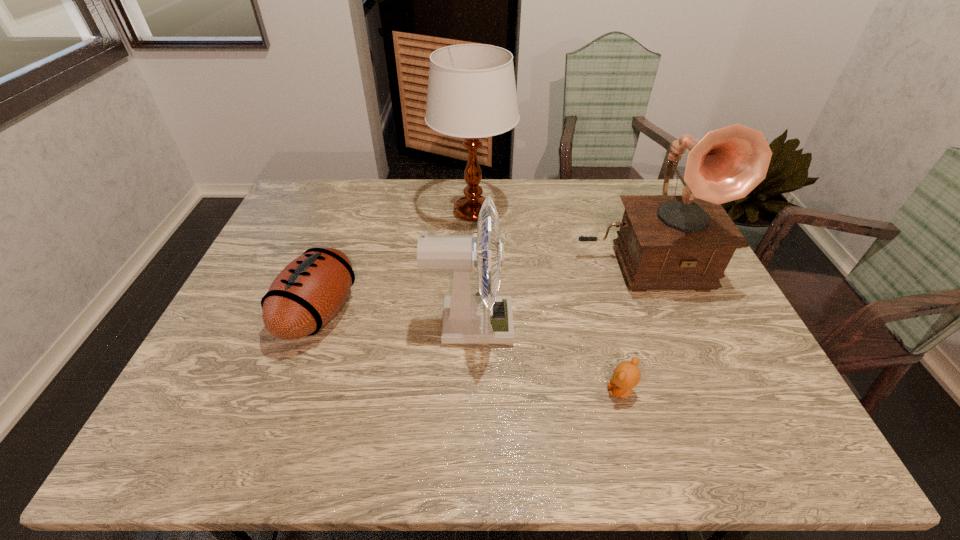
I want to click on free space located 0.150m on the front of the second shortest object, so click(x=281, y=415).

Find the location of a particular element. The image size is (960, 540). vacant area situated on the face of the teddy bear is located at coordinates (575, 392).

Find the location of a particular element. vacant space located 0.290m on the face of the teddy bear is located at coordinates (474, 392).

Where is `vacant area situated on the face of the teddy bear`? Image resolution: width=960 pixels, height=540 pixels. vacant area situated on the face of the teddy bear is located at coordinates (501, 392).

Find the location of `object that is at the far edge`. object that is at the far edge is located at coordinates (471, 94).

I want to click on object located in the left edge section of the desktop, so click(x=309, y=291).

Where is `object located at the right edge`? object located at the right edge is located at coordinates (666, 242).

Find the location of a particular element. This screenshot has width=960, height=540. vacant space at the far edge of the desktop is located at coordinates (575, 195).

In the image, there is a desktop. Identify the location of vacant area at the left edge. The height and width of the screenshot is (540, 960). (x=249, y=341).

What are the coordinates of `free space at the right edge` in the screenshot? It's located at (736, 329).